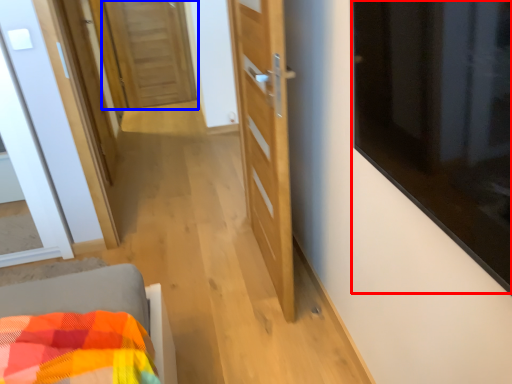
Question: Among these objects, which one is farthest to the camera, window (highlighted by a red box) or door (highlighted by a blue box)?

Choices:
 (A) window
 (B) door

Answer: (B)